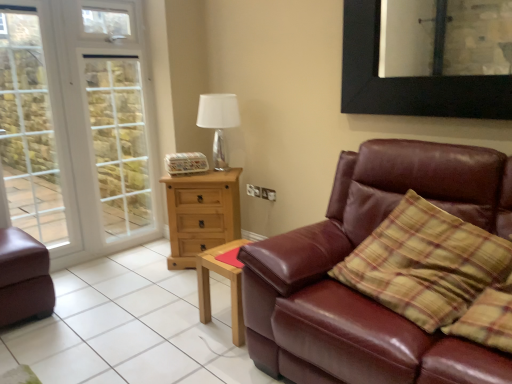
At what (x,y) coordinates should I click in order to perform the action: click on vacant space that's between matte brown leather couch at lower left, acting as the 1th studio couch starting from the left, and light wood rectangular table at center. Please return your answer as a coordinate pair (x, y). Looking at the image, I should click on (130, 314).